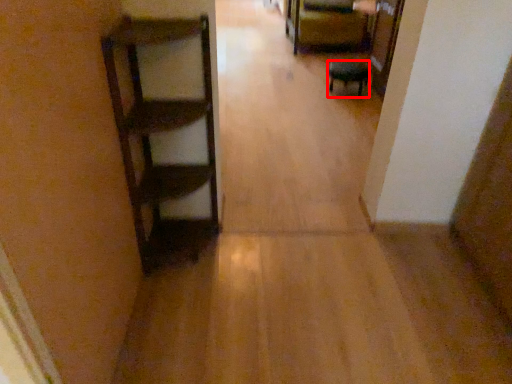
Question: From the image's perspective, where is furniture (annotated by the red box) located relative to furniture?

Choices:
 (A) above
 (B) below

Answer: (B)